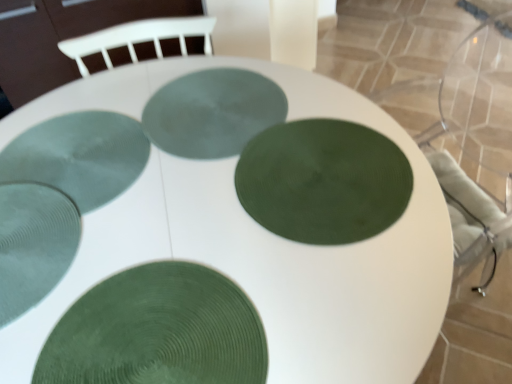
Where is `vacant area on top of clear textured glass at bottom left, positioned as the 2th glass plate in front-to-back order (from a real-world perspective)`? This screenshot has width=512, height=384. vacant area on top of clear textured glass at bottom left, positioned as the 2th glass plate in front-to-back order (from a real-world perspective) is located at coordinates (26, 238).